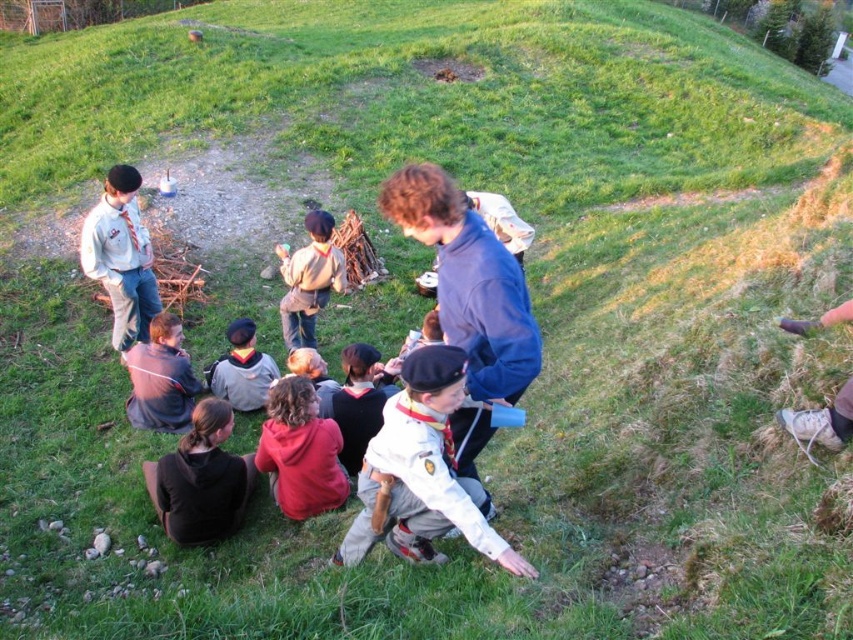
Question: Is dark gray fleece jacket at lower left to the left of dark gray sweater at center from the viewer's perspective?

Choices:
 (A) no
 (B) yes

Answer: (B)

Question: Which of the following is the farthest from the observer?

Choices:
 (A) brown fabric shirt at center
 (B) white shirt at upper left

Answer: (A)

Question: Is black fleece jacket at lower left to the right of dark gray fleece jacket at lower left from the viewer's perspective?

Choices:
 (A) no
 (B) yes

Answer: (B)

Question: In this image, where is black fleece jacket at lower left located relative to red fleece jacket at lower center?

Choices:
 (A) left
 (B) right

Answer: (A)

Question: Which of the following is the closest to the observer?

Choices:
 (A) (300, 260)
 (B) (286, 506)

Answer: (B)

Question: Which object appears closest to the camera in this image?

Choices:
 (A) white shirt at upper left
 (B) brown fabric shirt at center

Answer: (A)